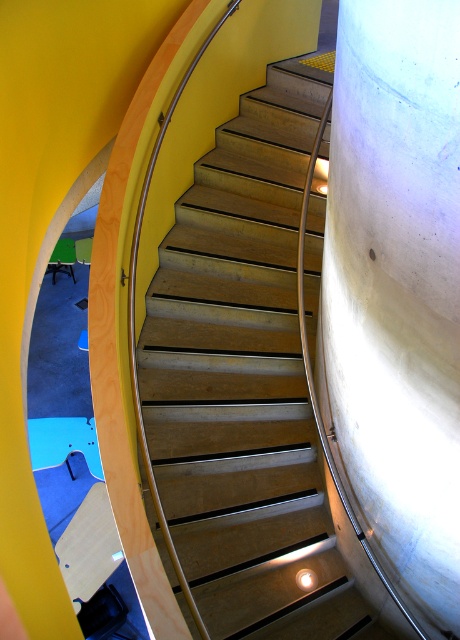
Question: Where is wooden stairs at center located in relation to white concrete pillar at right in the image?

Choices:
 (A) left
 (B) right

Answer: (A)

Question: Does wooden stairs at center appear on the left side of white concrete pillar at right?

Choices:
 (A) yes
 (B) no

Answer: (A)

Question: Is wooden stairs at center below white concrete pillar at right?

Choices:
 (A) yes
 (B) no

Answer: (B)

Question: Which point appears farthest from the camera in this image?

Choices:
 (A) (360, 163)
 (B) (248, 128)

Answer: (B)

Question: Which point is closer to the camera?

Choices:
 (A) (340, 273)
 (B) (207, 554)

Answer: (A)